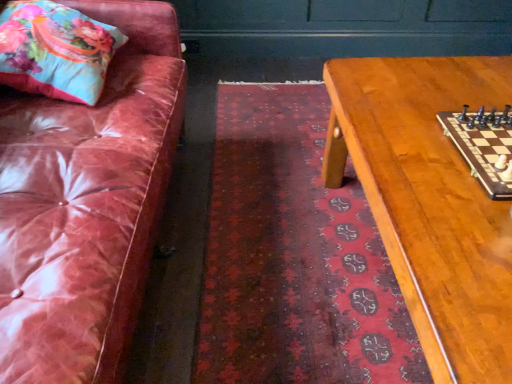
Where is `vacant space that is to the left of wooden chessboard at center`? vacant space that is to the left of wooden chessboard at center is located at coordinates (245, 266).